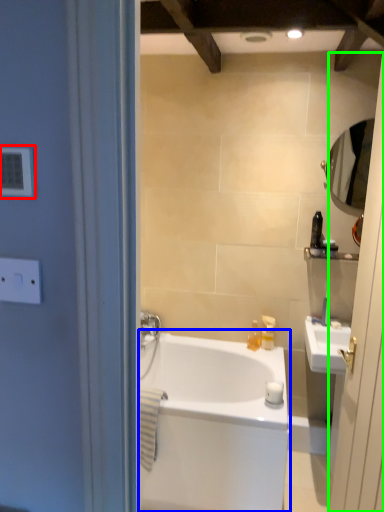
Question: Which is farther away from light switch (highlighted by a red box)? bathtub (highlighted by a blue box) or screen door (highlighted by a green box)?

Choices:
 (A) bathtub
 (B) screen door

Answer: (A)